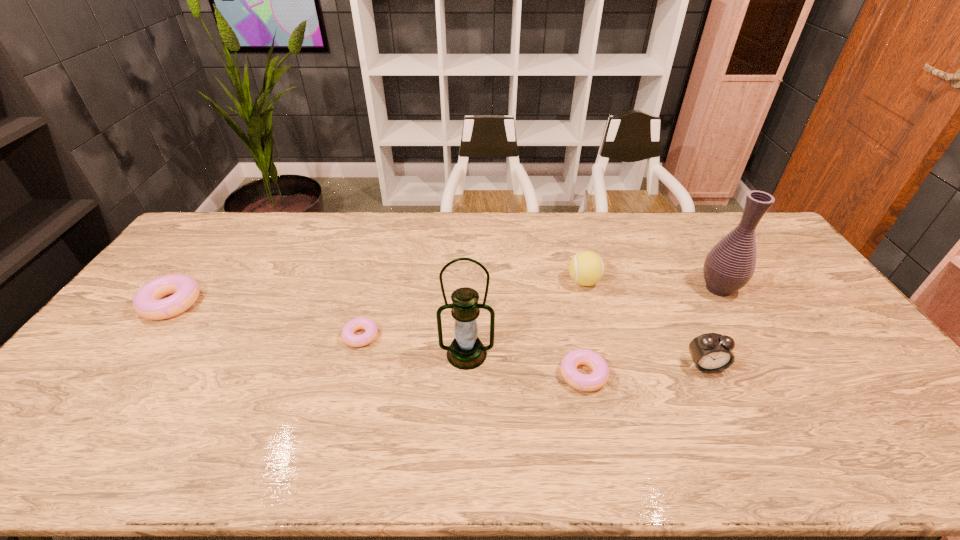
Where is `vacant space that is in between the second object from right to left and the sixth object from right to left`? The height and width of the screenshot is (540, 960). vacant space that is in between the second object from right to left and the sixth object from right to left is located at coordinates (533, 351).

The width and height of the screenshot is (960, 540). In order to click on empty space that is in between the nearest doughnut and the third object from left to right in this screenshot , I will do `click(525, 364)`.

Image resolution: width=960 pixels, height=540 pixels. What are the coordinates of `free space that is in between the rightmost object and the sixth object from left to right` in the screenshot? It's located at (711, 327).

Choose which object is the second nearest neighbor to the rightmost object. Please provide its 2D coordinates. Your answer should be formatted as a tuple, i.e. [(x, y)], where the tuple contains the x and y coordinates of a point satisfying the conditions above.

[(586, 268)]

Identify which object is the fourth nearest to the sixth object from left to right. Please provide its 2D coordinates. Your answer should be formatted as a tuple, i.e. [(x, y)], where the tuple contains the x and y coordinates of a point satisfying the conditions above.

[(466, 352)]

Identify which doughnut is the nearest to the alarm clock. Please provide its 2D coordinates. Your answer should be formatted as a tuple, i.e. [(x, y)], where the tuple contains the x and y coordinates of a point satisfying the conditions above.

[(585, 382)]

You are a GUI agent. You are given a task and a screenshot of the screen. Output one action in this format:
    pyautogui.click(x=<x>, y=<y>)
    Task: Click on the third closest doughnut to the alarm clock
    This screenshot has height=540, width=960.
    Given the screenshot: What is the action you would take?
    pyautogui.click(x=146, y=303)

At what (x,y) coordinates should I click in order to perform the action: click on blank area in the image that satisfies the following two spatial constraints: 1. on the back side of the second doughnut from left to right; 2. on the left side of the rightmost object. Please return your answer as a coordinate pair (x, y). Looking at the image, I should click on (373, 288).

Locate an element on the screen. free space that satisfies the following two spatial constraints: 1. on the back side of the rightmost object; 2. on the left side of the leftmost doughnut is located at coordinates [182, 288].